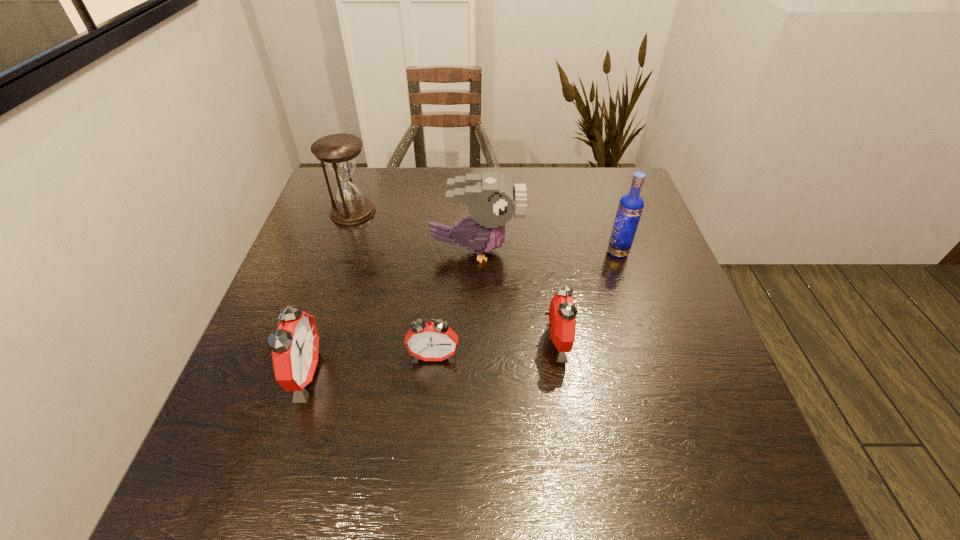
Find the location of a particular element. This screenshot has height=540, width=960. object that is at the near left corner is located at coordinates (295, 347).

Where is `vacant space at the far edge`? This screenshot has width=960, height=540. vacant space at the far edge is located at coordinates (392, 179).

Identify the location of free space at the left edge of the desktop. (x=345, y=256).

The height and width of the screenshot is (540, 960). In order to click on vacant space at the right edge of the desktop in this screenshot , I will do `click(645, 300)`.

Identify the location of vacant space at the far left corner of the desktop. (325, 211).

Locate an element on the screen. The height and width of the screenshot is (540, 960). vacant space at the near left corner of the desktop is located at coordinates (262, 423).

The height and width of the screenshot is (540, 960). In order to click on vacant region at the near right corner of the desktop in this screenshot , I will do `click(721, 422)`.

At what (x,y) coordinates should I click in order to perform the action: click on free spot between the farthest object and the leftmost alarm clock. Please return your answer as a coordinate pair (x, y). Looking at the image, I should click on (328, 293).

This screenshot has width=960, height=540. Find the location of `free spot between the farthest object and the leftmost alarm clock`. free spot between the farthest object and the leftmost alarm clock is located at coordinates (328, 293).

This screenshot has width=960, height=540. What are the coordinates of `free space between the hourglass and the second alarm clock from left to right` in the screenshot? It's located at (394, 285).